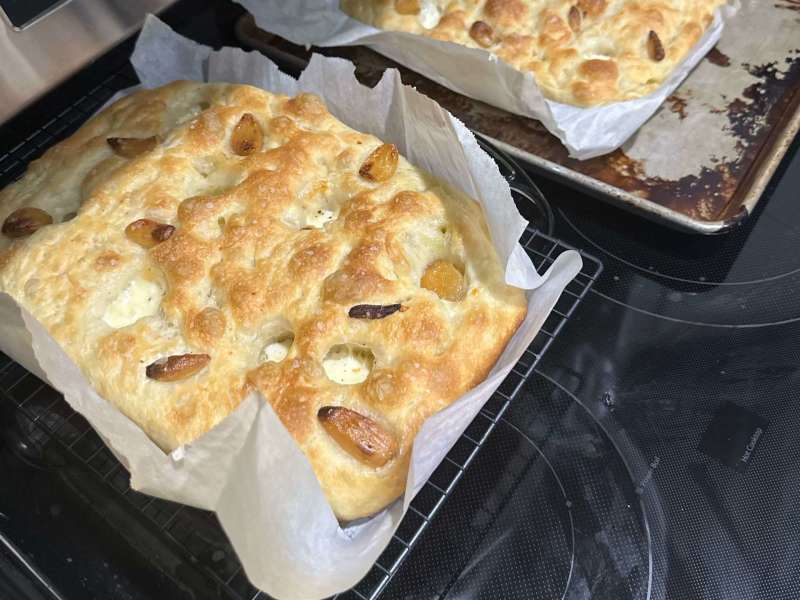
Find the location of `black electric hob`. black electric hob is located at coordinates click(638, 395).